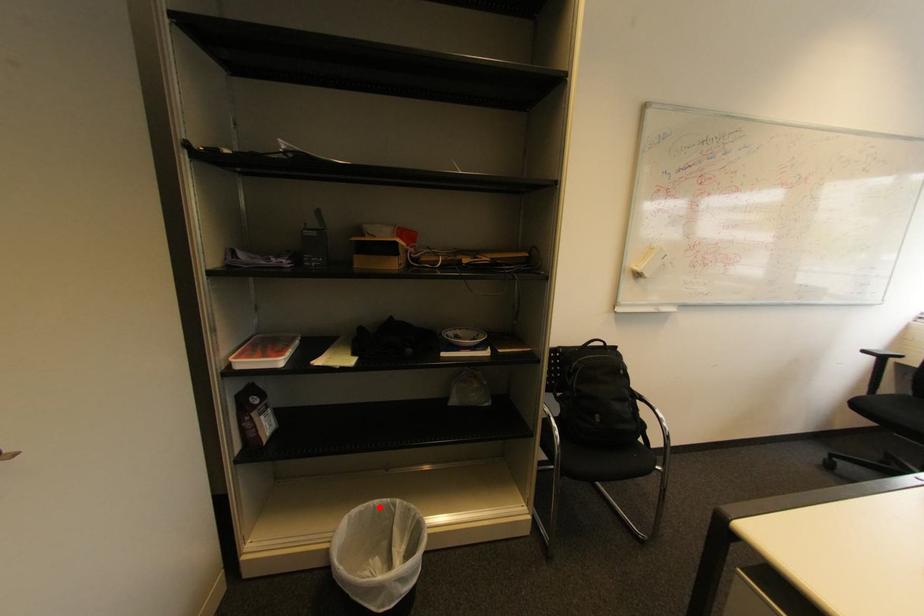
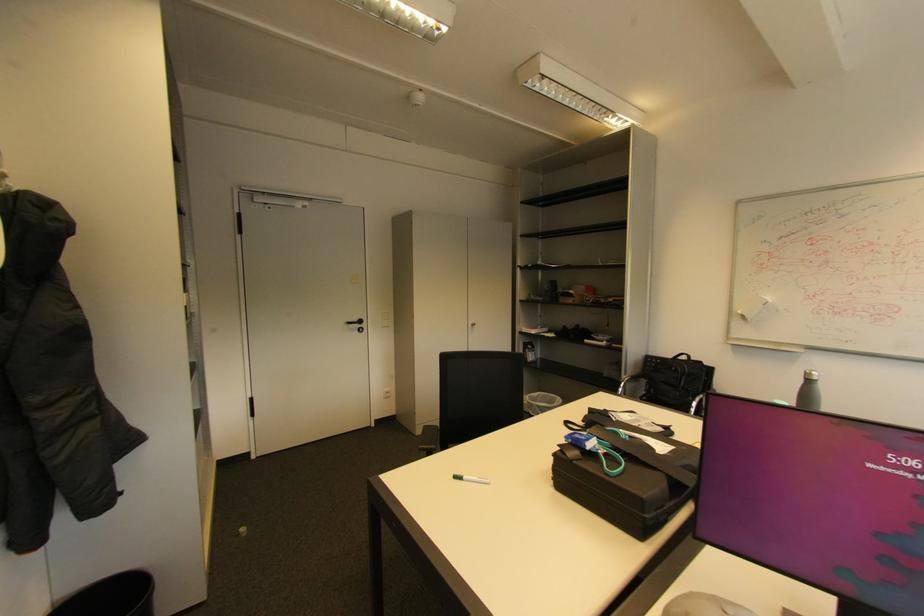
Locate, in the second image, the point that corresponds to the highlighted location in the first image.

(556, 397)